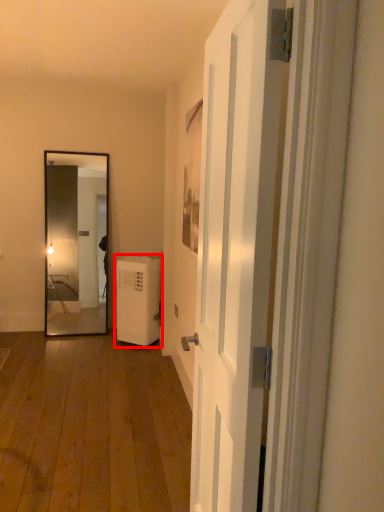
Question: From the image's perspective, what is the correct spatial relationship of water heater (annotated by the red box) in relation to door?

Choices:
 (A) above
 (B) below

Answer: (B)